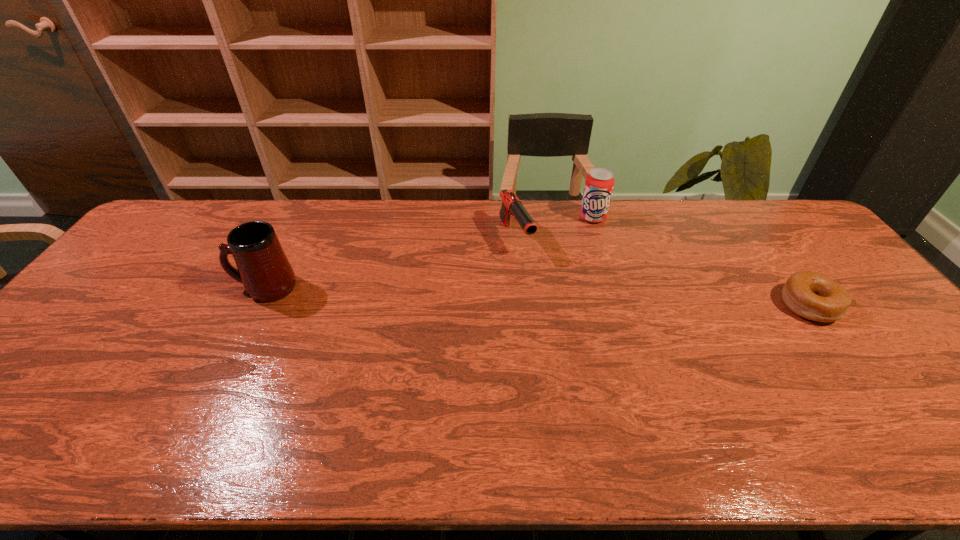
The width and height of the screenshot is (960, 540). I want to click on free space at the near left corner, so click(7, 414).

In the image, there is a desktop. Where is `vacant space at the far right corner`? vacant space at the far right corner is located at coordinates (747, 211).

Identify the location of free spot between the rightmost object and the leftmost object. The image size is (960, 540). (538, 296).

The width and height of the screenshot is (960, 540). Identify the location of free space between the shortest object and the second object from right to left. (701, 261).

Image resolution: width=960 pixels, height=540 pixels. What are the coordinates of `vacant region between the third object from right to left and the leftmost object` in the screenshot? It's located at (391, 263).

Image resolution: width=960 pixels, height=540 pixels. In order to click on unoccupied position between the second object from left to right and the shortest object in this screenshot , I will do `click(662, 272)`.

Identify the location of vacant point located between the soda can and the mug. (429, 253).

Identify the location of empty location between the shortest object and the soda can. The image size is (960, 540). (701, 261).

The height and width of the screenshot is (540, 960). I want to click on empty space that is in between the shortest object and the mug, so click(538, 296).

Find the location of `free space between the third object from left to right and the gun`. free space between the third object from left to right and the gun is located at coordinates (554, 228).